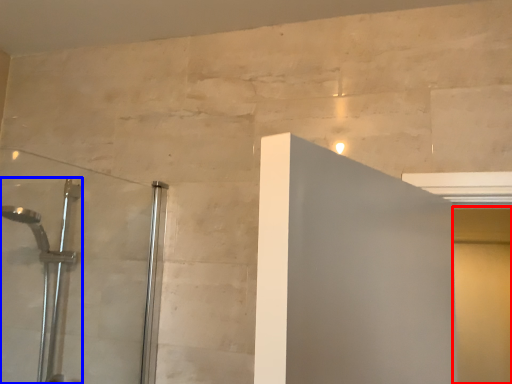
Question: Which point is closer to the camera, screen door (highlighted by a red box) or shower (highlighted by a blue box)?

Choices:
 (A) screen door
 (B) shower

Answer: (B)